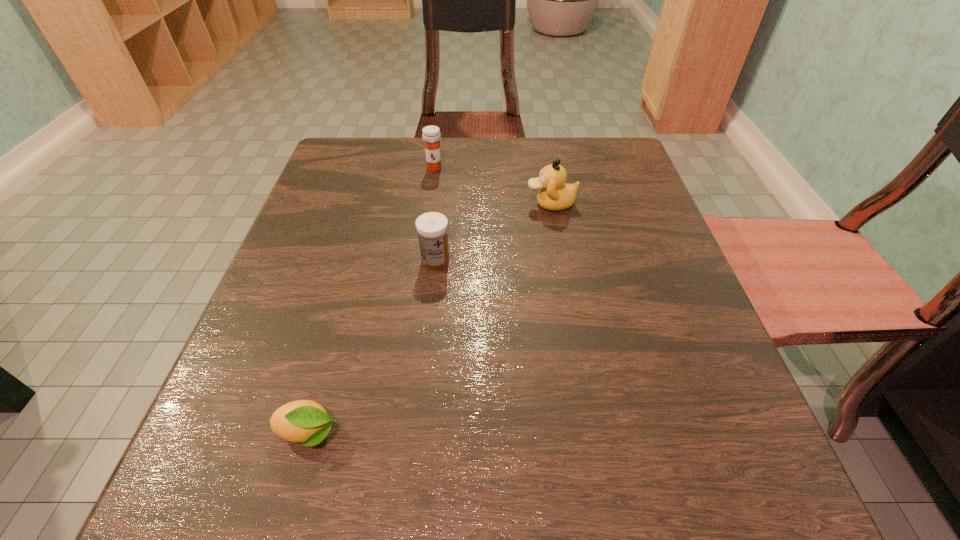
You are a GUI agent. You are given a task and a screenshot of the screen. Output one action in this format:
    pyautogui.click(x=<x>, y=<y>)
    Task: Click on the object that can be found as the third closest to the nearest object
    This screenshot has width=960, height=540.
    Given the screenshot: What is the action you would take?
    pyautogui.click(x=431, y=135)

At what (x,y) coordinates should I click in order to perform the action: click on the closest object relative to the rightmost object. Please return your answer as a coordinate pair (x, y). This screenshot has height=540, width=960. Looking at the image, I should click on tap(432, 227).

The image size is (960, 540). What are the coordinates of `free space that satisfies the following two spatial constraints: 1. on the front side of the nearer medicine; 2. with leaves positioned above the nearest object` in the screenshot? It's located at (418, 433).

Locate an element on the screen. This screenshot has width=960, height=540. blank area in the image that satisfies the following two spatial constraints: 1. on the label side of the farthest object; 2. with leaves positioned above the shortest object is located at coordinates (399, 433).

Where is `vacant space that satisfies the following two spatial constraints: 1. on the label side of the farthest object; 2. with leaves positioned above the leftmost object`? The height and width of the screenshot is (540, 960). vacant space that satisfies the following two spatial constraints: 1. on the label side of the farthest object; 2. with leaves positioned above the leftmost object is located at coordinates (399, 433).